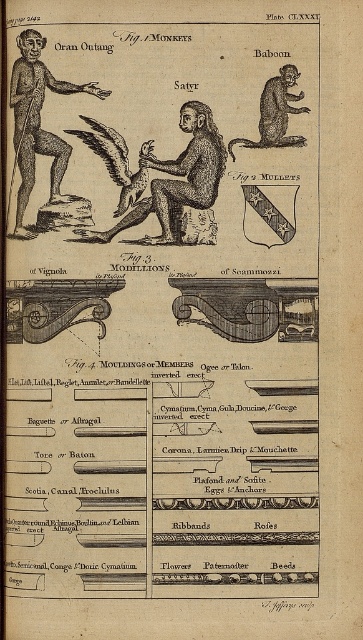
Can you confirm if black wood figure at left is shorter than brown fur baboon at upper right?

No, black wood figure at left is not shorter than brown fur baboon at upper right.

Which is behind, point (26, 72) or point (302, 93)?

The point (302, 93) is behind.

The height and width of the screenshot is (640, 363). Identify the location of black wood figure at left. (38, 122).

Can you confirm if brown fur baboon at upper right is smaller than brown wooden eagle at center?

Indeed, brown fur baboon at upper right has a smaller size compared to brown wooden eagle at center.

Is point (294, 113) more distant than point (141, 193)?

That is False.

Does point (284, 84) lie in front of point (119, 157)?

Yes, point (284, 84) is closer to viewer.

At what (x,y) coordinates should I click in order to perform the action: click on brown fur baboon at upper right. Please return your answer as a coordinate pair (x, y). Looking at the image, I should click on (275, 113).

This screenshot has width=363, height=640. What do you see at coordinates (173, 173) in the screenshot?
I see `brown textured figure at center` at bounding box center [173, 173].

Which is behind, point (141, 145) or point (299, 93)?

Point (141, 145)

Is point (215, 157) farther from camera compared to point (275, 100)?

That is True.

Locate an element on the screen. The height and width of the screenshot is (640, 363). brown textured figure at center is located at coordinates (173, 173).